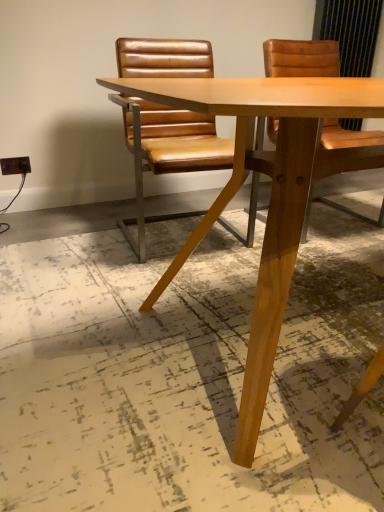
In order to face brown leather chair at center, should I rotate leftwards or rightwards?

Rotate left and turn 1.229 degrees.

Describe the element at coordinates (167, 152) in the screenshot. I see `brown leather chair at center` at that location.

The width and height of the screenshot is (384, 512). In order to click on brown leather chair at center in this screenshot , I will do `click(167, 152)`.

Identify the location of light brown wood table at center. This screenshot has height=512, width=384. (270, 198).

This screenshot has width=384, height=512. What do you see at coordinates (270, 198) in the screenshot?
I see `light brown wood table at center` at bounding box center [270, 198].

What is the approximate width of light brown wood table at center?

The width of light brown wood table at center is 36.50 inches.

The image size is (384, 512). Find the location of `brown leather chair at center`. brown leather chair at center is located at coordinates (167, 152).

Does light brown wood table at center appear on the right side of brown leather chair at center?

Correct, you'll find light brown wood table at center to the right of brown leather chair at center.

Considering their positions, is light brown wood table at center located in front of or behind brown leather chair at center?

Clearly, light brown wood table at center is in front of brown leather chair at center.

Is point (256, 341) positioned before point (165, 157)?

Yes.

From the image's perspective, between light brown wood table at center and brown leather chair at center, who is located below?

light brown wood table at center appears lower in the image.

From a real-world perspective, who is located lower, light brown wood table at center or brown leather chair at center?

In real-world perspective, light brown wood table at center is lower.

Can you confirm if light brown wood table at center is wider than brown leather chair at center?

Yes, light brown wood table at center is wider than brown leather chair at center.

Considering the sizes of light brown wood table at center and brown leather chair at center in the image, is light brown wood table at center taller or shorter than brown leather chair at center?

In the image, light brown wood table at center appears to be shorter than brown leather chair at center.

Considering the relative sizes of light brown wood table at center and brown leather chair at center in the image provided, is light brown wood table at center bigger than brown leather chair at center?

Yes.

Would you say light brown wood table at center is outside brown leather chair at center?

Indeed, light brown wood table at center is completely outside brown leather chair at center.

Is light brown wood table at center next to brown leather chair at center?

There is a gap between light brown wood table at center and brown leather chair at center.

Is light brown wood table at center turned away from brown leather chair at center?

Yes, light brown wood table at center's orientation is away from brown leather chair at center.

Based on the photo, how different are the orientations of light brown wood table at center and brown leather chair at center in degrees?

2.74 degrees separate the facing orientations of light brown wood table at center and brown leather chair at center.

Measure the distance from light brown wood table at center to brown leather chair at center.

light brown wood table at center is 27.24 inches from brown leather chair at center.

The image size is (384, 512). I want to click on table on the right of brown leather chair at center, so click(270, 198).

Based on their positions, is brown leather chair at center located to the left or right of light brown wood table at center?

Based on their positions, brown leather chair at center is located to the left of light brown wood table at center.

Relative to light brown wood table at center, is brown leather chair at center in front or behind?

Visually, brown leather chair at center is located behind light brown wood table at center.

Which is closer to the camera, (260, 146) or (259, 316)?

Point (260, 146) is farther from the camera than point (259, 316).

From the image's perspective, is brown leather chair at center over light brown wood table at center?

Yes, from the image's perspective, brown leather chair at center is above light brown wood table at center.

Looking at this image, from a real-world perspective, is brown leather chair at center on light brown wood table at center?

Yes, from a real-world perspective, brown leather chair at center is above light brown wood table at center.

Considering the sizes of objects brown leather chair at center and light brown wood table at center in the image provided, who is thinner, brown leather chair at center or light brown wood table at center?

brown leather chair at center is thinner.

Does brown leather chair at center have a greater height compared to light brown wood table at center?

Indeed, brown leather chair at center has a greater height compared to light brown wood table at center.

From the picture: Which of these two, brown leather chair at center or light brown wood table at center, is bigger?

With larger size is light brown wood table at center.

Is brown leather chair at center positioned beyond the bounds of light brown wood table at center?

Yes, brown leather chair at center is located beyond the bounds of light brown wood table at center.

Is brown leather chair at center not close to light brown wood table at center?

No, brown leather chair at center is not far away from light brown wood table at center.

Could you tell me if brown leather chair at center is turned towards light brown wood table at center?

Yes, brown leather chair at center is aimed at light brown wood table at center.

What's the angular difference between brown leather chair at center and light brown wood table at center's facing directions?

2.74 degrees separate the facing orientations of brown leather chair at center and light brown wood table at center.

Locate an element on the screen. The height and width of the screenshot is (512, 384). chair that is on the left side of light brown wood table at center is located at coordinates (167, 152).

Find the location of a particular element. chair above the light brown wood table at center (from a real-world perspective) is located at coordinates (167, 152).

The image size is (384, 512). Identify the location of table on the right of brown leather chair at center. (270, 198).